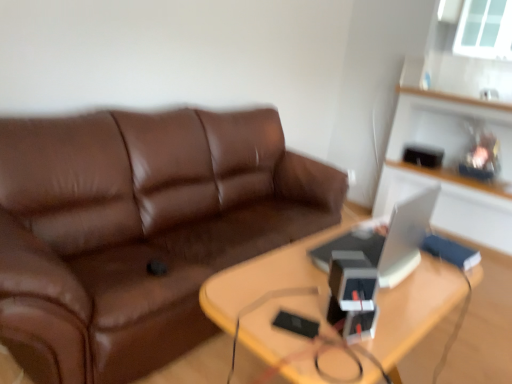
Question: Is transparent glass window at upper right to the left of white glossy computer at right from the viewer's perspective?

Choices:
 (A) no
 (B) yes

Answer: (A)

Question: From a real-world perspective, is transparent glass window at upper right on white glossy computer at right?

Choices:
 (A) yes
 (B) no

Answer: (A)

Question: Is transparent glass window at upper right at the right side of white glossy computer at right?

Choices:
 (A) yes
 (B) no

Answer: (A)

Question: From the image's perspective, would you say transparent glass window at upper right is shown under white glossy computer at right?

Choices:
 (A) no
 (B) yes

Answer: (A)

Question: From a real-world perspective, does transparent glass window at upper right sit lower than white glossy computer at right?

Choices:
 (A) no
 (B) yes

Answer: (A)

Question: Based on their positions, is wooden table at center located to the left or right of transparent glass window at upper right?

Choices:
 (A) right
 (B) left

Answer: (B)

Question: In terms of height, does wooden table at center look taller or shorter compared to transparent glass window at upper right?

Choices:
 (A) short
 (B) tall

Answer: (A)

Question: Is wooden table at center in front of or behind transparent glass window at upper right in the image?

Choices:
 (A) front
 (B) behind

Answer: (A)

Question: In terms of width, does wooden table at center look wider or thinner when compared to transparent glass window at upper right?

Choices:
 (A) wide
 (B) thin

Answer: (A)

Question: From the image's perspective, is white glossy computer at right above or below transparent glass window at upper right?

Choices:
 (A) below
 (B) above

Answer: (A)

Question: Considering the positions of white glossy computer at right and transparent glass window at upper right in the image, is white glossy computer at right bigger or smaller than transparent glass window at upper right?

Choices:
 (A) small
 (B) big

Answer: (A)

Question: Considering the positions of point (425, 208) and point (461, 33), is point (425, 208) closer or farther from the camera than point (461, 33)?

Choices:
 (A) closer
 (B) farther

Answer: (A)

Question: Is white glossy computer at right situated inside transparent glass window at upper right or outside?

Choices:
 (A) inside
 (B) outside

Answer: (B)

Question: Considering their positions, is white glossy computer at right located in front of or behind wooden table at center?

Choices:
 (A) behind
 (B) front

Answer: (A)

Question: In terms of width, does white glossy computer at right look wider or thinner when compared to wooden table at center?

Choices:
 (A) thin
 (B) wide

Answer: (A)